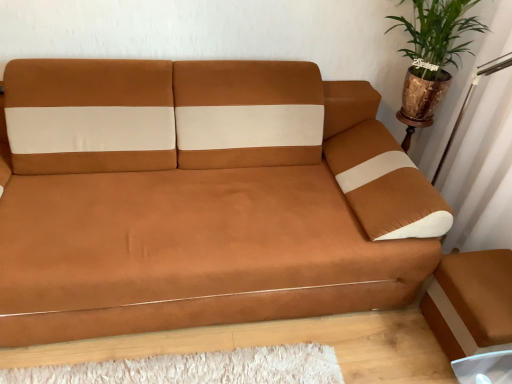
Question: Do you think green leafy plant in metallic pot at upper right is within brown leather couch at center, or outside of it?

Choices:
 (A) inside
 (B) outside

Answer: (B)

Question: From their relative heights in the image, would you say green leafy plant in metallic pot at upper right is taller or shorter than brown leather couch at center?

Choices:
 (A) tall
 (B) short

Answer: (B)

Question: From a real-world perspective, relative to brown leather couch at center, is green leafy plant in metallic pot at upper right vertically above or below?

Choices:
 (A) below
 (B) above

Answer: (B)

Question: Relative to green leafy plant in metallic pot at upper right, is brown leather couch at center in front or behind?

Choices:
 (A) behind
 (B) front

Answer: (B)

Question: From the image's perspective, relative to green leafy plant in metallic pot at upper right, is brown leather couch at center above or below?

Choices:
 (A) below
 (B) above

Answer: (A)

Question: In the image, is brown leather couch at center on the left side or the right side of green leafy plant in metallic pot at upper right?

Choices:
 (A) right
 (B) left

Answer: (B)

Question: From a real-world perspective, relative to green leafy plant in metallic pot at upper right, is brown leather couch at center vertically above or below?

Choices:
 (A) above
 (B) below

Answer: (B)